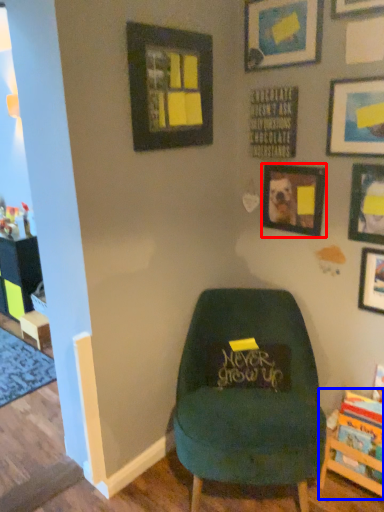
Question: Which object is closer to the camera taking this photo, picture frame (highlighted by a red box) or shelf (highlighted by a blue box)?

Choices:
 (A) picture frame
 (B) shelf

Answer: (B)